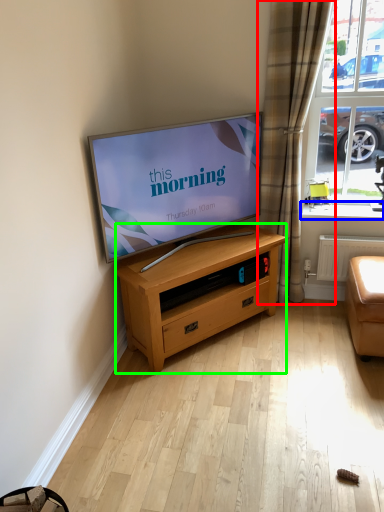
Question: Which object is the closest to the curtain (highlighted by a red box)? Choose among these: window sill (highlighted by a blue box) or chest of drawers (highlighted by a green box).

Choices:
 (A) window sill
 (B) chest of drawers

Answer: (A)